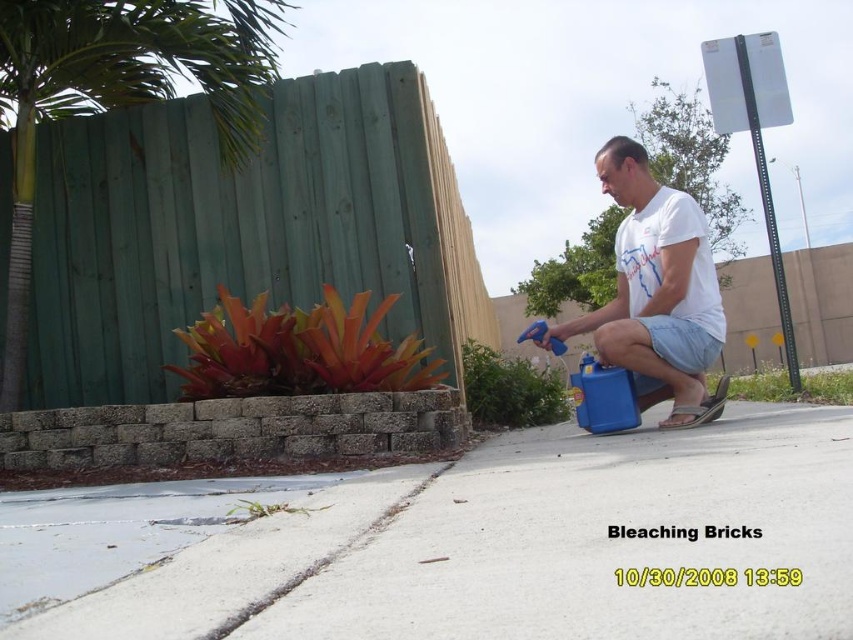
From the picture: Does white concrete pavement at center have a greater height compared to white matte shirt at center?

Incorrect, white concrete pavement at center's height is not larger of white matte shirt at center's.

How distant is white concrete pavement at center from white matte shirt at center?

76.71 centimeters

Locate an element on the screen. This screenshot has width=853, height=640. white concrete pavement at center is located at coordinates (526, 545).

Looking at this image, can you confirm if green wood palm tree at upper left is smaller than white matte shirt at center?

No.

Can you confirm if green wood palm tree at upper left is positioned above white matte shirt at center?

Yes.

Is point (109, 77) closer to camera compared to point (566, 332)?

No, (109, 77) is behind (566, 332).

Identify the location of green wood palm tree at upper left. (119, 92).

Who is positioned more to the left, white concrete pavement at center or green wood palm tree at upper left?

A: Positioned to the left is green wood palm tree at upper left.

Locate an element on the screen. This screenshot has height=640, width=853. white concrete pavement at center is located at coordinates (526, 545).